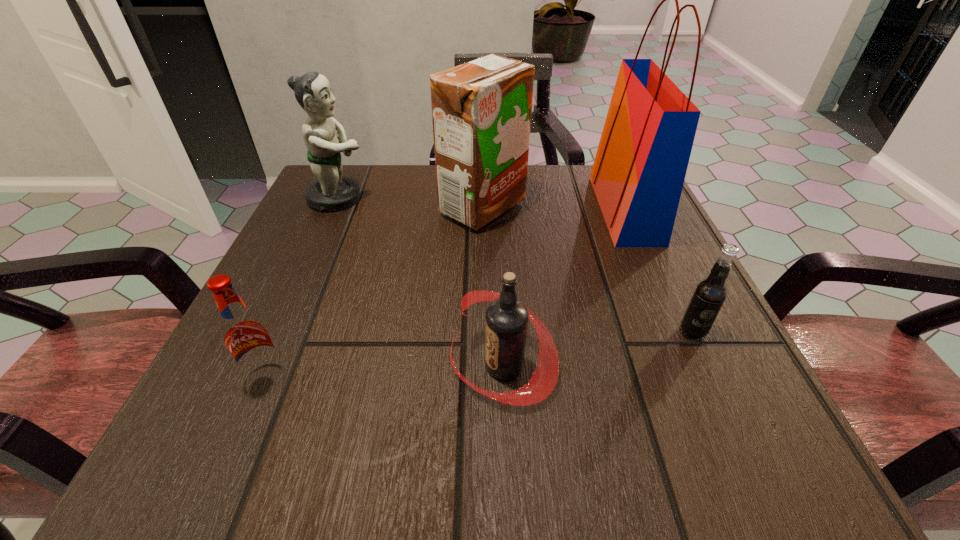
Identify the location of free space located on the straw side of the carton. Image resolution: width=960 pixels, height=540 pixels. (302, 207).

I want to click on vacant region located 0.180m on the straw side of the carton, so click(x=354, y=207).

This screenshot has width=960, height=540. Identify the location of vacant space located on the front-facing side of the figurine. (540, 198).

Where is `vacant space located on the back of the leftmost root beer`? This screenshot has width=960, height=540. vacant space located on the back of the leftmost root beer is located at coordinates (300, 298).

Find the location of `vacant region located 0.250m on the label of the second root beer from right to left`. vacant region located 0.250m on the label of the second root beer from right to left is located at coordinates (274, 366).

You are a GUI agent. You are given a task and a screenshot of the screen. Output one action in this format:
    pyautogui.click(x=<x>, y=<y>)
    Task: Click on the free location located on the label of the second root beer from right to left
    Image resolution: width=960 pixels, height=540 pixels.
    Given the screenshot: What is the action you would take?
    pyautogui.click(x=330, y=366)

Identify the location of vacant space located on the label of the second root beer from right to left. (302, 366).

You are a GUI agent. You are given a task and a screenshot of the screen. Output one action in this format:
    pyautogui.click(x=<x>, y=<y>)
    Task: Click on the vacant position located on the label of the rightmost root beer
    The height and width of the screenshot is (540, 960).
    Given the screenshot: What is the action you would take?
    pyautogui.click(x=752, y=461)

Where is `shopping bag that is at the far edge`? The height and width of the screenshot is (540, 960). shopping bag that is at the far edge is located at coordinates (638, 173).

I want to click on carton situated at the far edge, so click(481, 110).